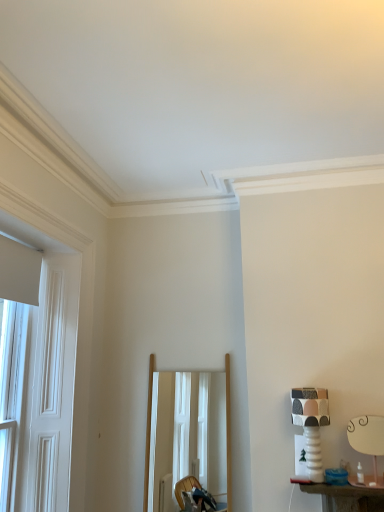
This screenshot has width=384, height=512. What are the coordinates of `wooden frame mirror at center` in the screenshot? It's located at (188, 431).

The image size is (384, 512). What are the coordinates of `white wooden door at left` in the screenshot? It's located at (47, 375).

Is white ceramic table lamp at right, the second table lamp viewed from the left, aimed at patterned ceramic table lamp at right, which ranks as the 1th table lamp in left-to-right order?

No.

Considering the relative sizes of white ceramic table lamp at right, which is counted as the first table lamp, starting from the right, and patterned ceramic table lamp at right, which ranks as the 1th table lamp in left-to-right order, in the image provided, is white ceramic table lamp at right, which is counted as the first table lamp, starting from the right, thinner than patterned ceramic table lamp at right, which ranks as the 1th table lamp in left-to-right order,?

Indeed, white ceramic table lamp at right, which is counted as the first table lamp, starting from the right, has a lesser width compared to patterned ceramic table lamp at right, which ranks as the 1th table lamp in left-to-right order.

From a real-world perspective, between white ceramic table lamp at right, which is counted as the first table lamp, starting from the right, and patterned ceramic table lamp at right, which is the 2th table lamp in right-to-left order, who is vertically higher?

patterned ceramic table lamp at right, which is the 2th table lamp in right-to-left order.

Can you confirm if patterned ceramic table lamp at right, which ranks as the 1th table lamp in left-to-right order, is shorter than wooden frame mirror at center?

Correct, patterned ceramic table lamp at right, which ranks as the 1th table lamp in left-to-right order, is not as tall as wooden frame mirror at center.

Is wooden frame mirror at center surrounded by patterned ceramic table lamp at right, which is the 2th table lamp in right-to-left order?

Definitely not — wooden frame mirror at center is not inside patterned ceramic table lamp at right, which is the 2th table lamp in right-to-left order.

Can you confirm if patterned ceramic table lamp at right, which ranks as the 1th table lamp in left-to-right order, is wider than wooden frame mirror at center?

Correct, the width of patterned ceramic table lamp at right, which ranks as the 1th table lamp in left-to-right order, exceeds that of wooden frame mirror at center.

Find the location of `table lamp located above the wooden frame mirror at center (from a real-world perspective)`. table lamp located above the wooden frame mirror at center (from a real-world perspective) is located at coordinates (310, 426).

From a real-world perspective, between patterned ceramic table lamp at right, which is the 2th table lamp in right-to-left order, and white ceramic table lamp at right, the second table lamp viewed from the left, who is vertically higher?

patterned ceramic table lamp at right, which is the 2th table lamp in right-to-left order, is physically above.

From the image's perspective, which is above, patterned ceramic table lamp at right, which is the 2th table lamp in right-to-left order, or white ceramic table lamp at right, which is counted as the first table lamp, starting from the right?

From the image's view, patterned ceramic table lamp at right, which is the 2th table lamp in right-to-left order, is above.

Can you confirm if patterned ceramic table lamp at right, which ranks as the 1th table lamp in left-to-right order, is positioned to the left of white ceramic table lamp at right, the second table lamp viewed from the left?

Yes.

Is patterned ceramic table lamp at right, which ranks as the 1th table lamp in left-to-right order, taller or shorter than white ceramic table lamp at right, which is counted as the first table lamp, starting from the right?

Clearly, patterned ceramic table lamp at right, which ranks as the 1th table lamp in left-to-right order, is taller compared to white ceramic table lamp at right, which is counted as the first table lamp, starting from the right.

Is white ceramic table lamp at right, the second table lamp viewed from the left, at the left side of white wooden door at left?

No, white ceramic table lamp at right, the second table lamp viewed from the left, is not to the left of white wooden door at left.

Which of these two, white ceramic table lamp at right, the second table lamp viewed from the left, or white wooden door at left, is bigger?

Bigger between the two is white wooden door at left.

Measure the distance between white ceramic table lamp at right, which is counted as the first table lamp, starting from the right, and white wooden door at left.

A distance of 5.76 feet exists between white ceramic table lamp at right, which is counted as the first table lamp, starting from the right, and white wooden door at left.

Looking at this image, is white ceramic table lamp at right, the second table lamp viewed from the left, completely or partially outside of white wooden door at left?

Yes, white ceramic table lamp at right, the second table lamp viewed from the left, is outside of white wooden door at left.

Is wooden frame mirror at center taller or shorter than white ceramic table lamp at right, the second table lamp viewed from the left?

Considering their sizes, wooden frame mirror at center has more height than white ceramic table lamp at right, the second table lamp viewed from the left.

From the image's perspective, between wooden frame mirror at center and white ceramic table lamp at right, the second table lamp viewed from the left, which one is located above?

white ceramic table lamp at right, the second table lamp viewed from the left, is shown above in the image.

Based on the photo, in the image, is wooden frame mirror at center on the left side or the right side of white ceramic table lamp at right, which is counted as the first table lamp, starting from the right?

From the image, it's evident that wooden frame mirror at center is to the left of white ceramic table lamp at right, which is counted as the first table lamp, starting from the right.

Considering the sizes of wooden frame mirror at center and white ceramic table lamp at right, the second table lamp viewed from the left, in the image, is wooden frame mirror at center wider or thinner than white ceramic table lamp at right, the second table lamp viewed from the left,?

wooden frame mirror at center is wider than white ceramic table lamp at right, the second table lamp viewed from the left.

What's the angular difference between wooden frame mirror at center and patterned ceramic table lamp at right, which is the 2th table lamp in right-to-left order,'s facing directions?

wooden frame mirror at center and patterned ceramic table lamp at right, which is the 2th table lamp in right-to-left order, are facing 5.34 degrees away from each other.

Is wooden frame mirror at center shorter than patterned ceramic table lamp at right, which ranks as the 1th table lamp in left-to-right order?

Incorrect, the height of wooden frame mirror at center does not fall short of that of patterned ceramic table lamp at right, which ranks as the 1th table lamp in left-to-right order.

You are a GUI agent. You are given a task and a screenshot of the screen. Output one action in this format:
    pyautogui.click(x=<x>, y=<y>)
    Task: Click on the mirror on the left of patterned ceramic table lamp at right, which ranks as the 1th table lamp in left-to-right order
    
    Given the screenshot: What is the action you would take?
    pyautogui.click(x=188, y=431)

From a real-world perspective, which object rests below the other?

wooden frame mirror at center is physically lower.

Based on the photo, which is behind, wooden frame mirror at center or white wooden door at left?

wooden frame mirror at center is further away from the camera.

The image size is (384, 512). I want to click on window in front of the wooden frame mirror at center, so click(47, 375).

Between point (153, 400) and point (59, 356), which one is positioned behind?

The point (153, 400) is behind.

Identify the location of table lamp to the right of patterned ceramic table lamp at right, which is the 2th table lamp in right-to-left order. The width and height of the screenshot is (384, 512). (367, 437).

Where is `mirror on the left of patterned ceramic table lamp at right, which is the 2th table lamp in right-to-left order`? Image resolution: width=384 pixels, height=512 pixels. mirror on the left of patterned ceramic table lamp at right, which is the 2th table lamp in right-to-left order is located at coordinates (188, 431).

Considering their positions, is white ceramic table lamp at right, the second table lamp viewed from the left, positioned further to patterned ceramic table lamp at right, which is the 2th table lamp in right-to-left order, than wooden frame mirror at center?

wooden frame mirror at center.

Considering their positions, is white ceramic table lamp at right, which is counted as the first table lamp, starting from the right, positioned closer to white wooden door at left than wooden frame mirror at center?

wooden frame mirror at center is closer to white wooden door at left.

Considering their positions, is white ceramic table lamp at right, the second table lamp viewed from the left, positioned closer to wooden frame mirror at center than patterned ceramic table lamp at right, which is the 2th table lamp in right-to-left order?

patterned ceramic table lamp at right, which is the 2th table lamp in right-to-left order, is closer to wooden frame mirror at center.

Looking at the image, which one is located closer to wooden frame mirror at center, white wooden door at left or white ceramic table lamp at right, the second table lamp viewed from the left?

The object closer to wooden frame mirror at center is white wooden door at left.

From the picture: When comparing their distances from white wooden door at left, does patterned ceramic table lamp at right, which ranks as the 1th table lamp in left-to-right order, or white ceramic table lamp at right, the second table lamp viewed from the left, seem further?

white ceramic table lamp at right, the second table lamp viewed from the left.

Considering their positions, is patterned ceramic table lamp at right, which is the 2th table lamp in right-to-left order, positioned further to wooden frame mirror at center than white wooden door at left?

The object further to wooden frame mirror at center is white wooden door at left.

Looking at this image, based on their spatial positions, is white ceramic table lamp at right, which is counted as the first table lamp, starting from the right, or white wooden door at left closer to wooden frame mirror at center?

white wooden door at left.

Looking at the image, which one is located closer to patterned ceramic table lamp at right, which ranks as the 1th table lamp in left-to-right order, wooden frame mirror at center or white ceramic table lamp at right, which is counted as the first table lamp, starting from the right?

Among the two, white ceramic table lamp at right, which is counted as the first table lamp, starting from the right, is located nearer to patterned ceramic table lamp at right, which ranks as the 1th table lamp in left-to-right order.

Locate an element on the screen. Image resolution: width=384 pixels, height=512 pixels. table lamp located between white wooden door at left and white ceramic table lamp at right, which is counted as the first table lamp, starting from the right, in the left-right direction is located at coordinates (310, 426).

The height and width of the screenshot is (512, 384). What are the coordinates of `mirror located between white wooden door at left and white ceramic table lamp at right, the second table lamp viewed from the left, in the left-right direction` in the screenshot? It's located at (188, 431).

At what (x,y) coordinates should I click in order to perform the action: click on table lamp between wooden frame mirror at center and white ceramic table lamp at right, which is counted as the first table lamp, starting from the right, from left to right. Please return your answer as a coordinate pair (x, y). Image resolution: width=384 pixels, height=512 pixels. Looking at the image, I should click on (310, 426).

The image size is (384, 512). I want to click on mirror situated between white wooden door at left and patterned ceramic table lamp at right, which is the 2th table lamp in right-to-left order, from left to right, so click(188, 431).